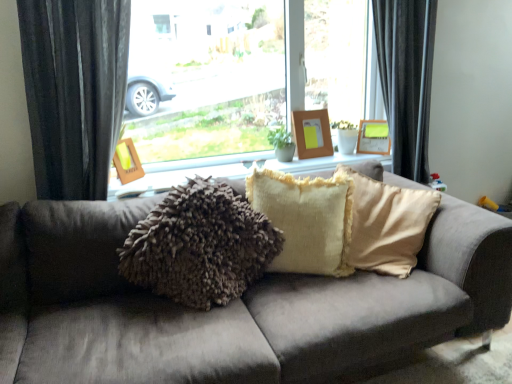
Question: From a real-world perspective, is fuzzy beige pillow at center beneath fuzzy fabric pillows at center?

Choices:
 (A) yes
 (B) no

Answer: (A)

Question: Can you confirm if fuzzy beige pillow at center is shorter than fuzzy fabric pillows at center?

Choices:
 (A) yes
 (B) no

Answer: (B)

Question: Is fuzzy beige pillow at center in contact with fuzzy fabric pillows at center?

Choices:
 (A) no
 (B) yes

Answer: (A)

Question: Can you confirm if fuzzy beige pillow at center is positioned to the left of fuzzy fabric pillows at center?

Choices:
 (A) yes
 (B) no

Answer: (B)

Question: From a real-world perspective, does fuzzy beige pillow at center stand above fuzzy fabric pillows at center?

Choices:
 (A) yes
 (B) no

Answer: (B)

Question: From a real-world perspective, relative to woodenwoodenpicture frame at left, which appears as the 1th picture frame when viewed from the left, is fuzzy beige pillow at center vertically above or below?

Choices:
 (A) above
 (B) below

Answer: (B)

Question: From the image's perspective, is fuzzy beige pillow at center located above or below woodenwoodenpicture frame at left, the first picture frame positioned from the front?

Choices:
 (A) below
 (B) above

Answer: (A)

Question: Visually, is fuzzy beige pillow at center positioned to the left or to the right of woodenwoodenpicture frame at left, the third picture frame from the right?

Choices:
 (A) right
 (B) left

Answer: (A)

Question: Looking at the image, does fuzzy beige pillow at center seem bigger or smaller compared to woodenwoodenpicture frame at left, the third picture frame from the right?

Choices:
 (A) big
 (B) small

Answer: (A)

Question: Looking at the image, does woodenwoodenpicture frame at left, the first picture frame positioned from the front, seem bigger or smaller compared to fuzzy beige pillow at center?

Choices:
 (A) big
 (B) small

Answer: (B)

Question: From the image's perspective, is woodenwoodenpicture frame at left, the third picture frame from the right, located above or below fuzzy beige pillow at center?

Choices:
 (A) above
 (B) below

Answer: (A)

Question: Considering the positions of woodenwoodenpicture frame at left, which appears as the 1th picture frame when viewed from the left, and fuzzy beige pillow at center in the image, is woodenwoodenpicture frame at left, which appears as the 1th picture frame when viewed from the left, wider or thinner than fuzzy beige pillow at center?

Choices:
 (A) thin
 (B) wide

Answer: (A)

Question: Considering the positions of point (128, 168) and point (249, 180), is point (128, 168) closer or farther from the camera than point (249, 180)?

Choices:
 (A) farther
 (B) closer

Answer: (A)

Question: Would you say wooden frame at center, which is the 2th picture frame in back-to-front order, is inside or outside velvet brown couch at center?

Choices:
 (A) inside
 (B) outside

Answer: (B)

Question: Does point (297, 130) appear closer or farther from the camera than point (308, 380)?

Choices:
 (A) closer
 (B) farther

Answer: (B)